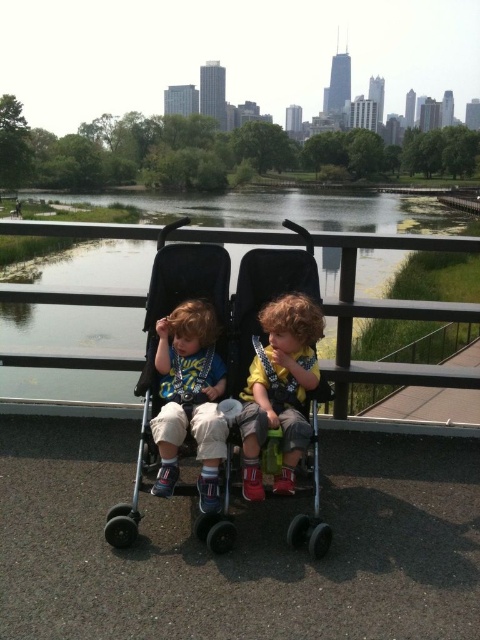
Question: Which object is positioned closest to the yellow cotton shirt at center?

Choices:
 (A) matte blue shirt at center
 (B) green grass at lower center
 (C) black plastic stroller at center

Answer: (C)

Question: Does black plastic stroller at center appear on the left side of yellow cotton shirt at center?

Choices:
 (A) no
 (B) yes

Answer: (B)

Question: Is green grass at lower center behind black plastic stroller at center?

Choices:
 (A) yes
 (B) no

Answer: (A)

Question: Which object appears farthest from the camera in this image?

Choices:
 (A) green grass at lower center
 (B) matte blue shirt at center

Answer: (A)

Question: Based on their relative distances, which object is nearer to the black plastic stroller at center?

Choices:
 (A) green grass at lower center
 (B) matte blue shirt at center
 (C) yellow cotton shirt at center

Answer: (B)

Question: Where is green grass at lower center located in relation to matte blue shirt at center in the image?

Choices:
 (A) right
 (B) left

Answer: (B)